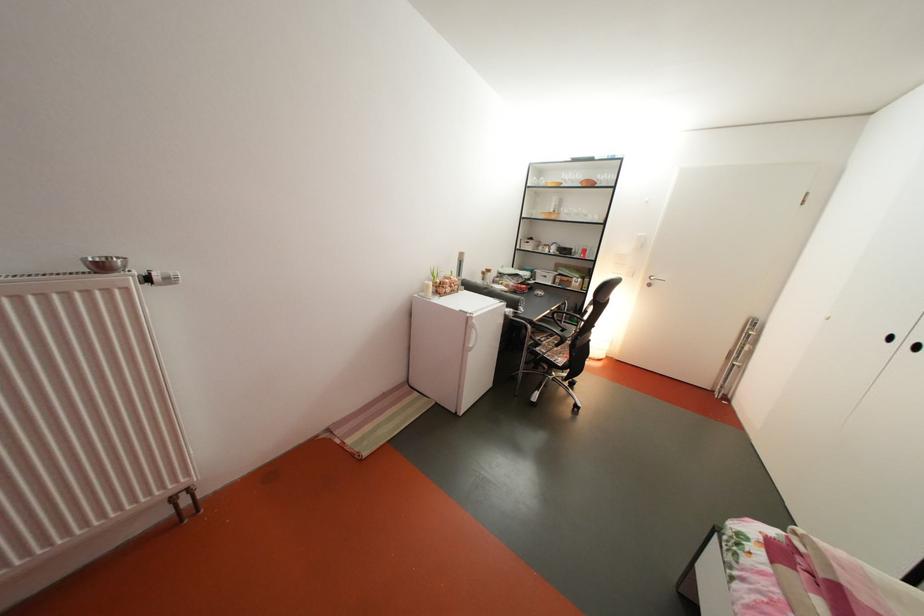
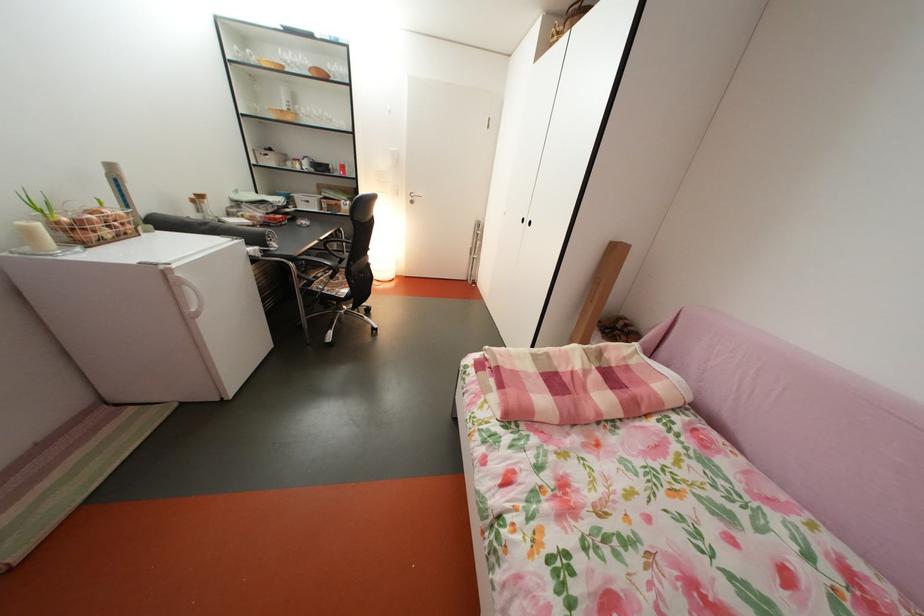
Locate, in the second image, the point that corresponds to point 480,322 in the first image.

(174, 274)